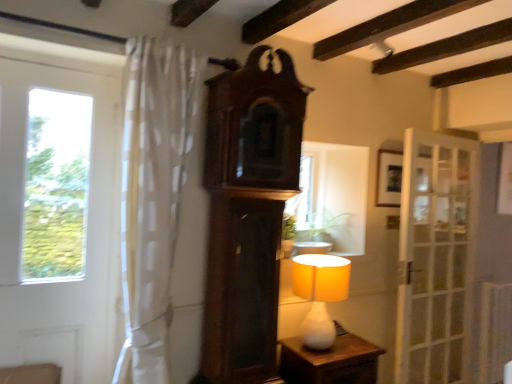
This screenshot has height=384, width=512. Find the location of `free space above white glass door at left, the first door viewed from the front (from a real-world perspective)`. free space above white glass door at left, the first door viewed from the front (from a real-world perspective) is located at coordinates (51, 65).